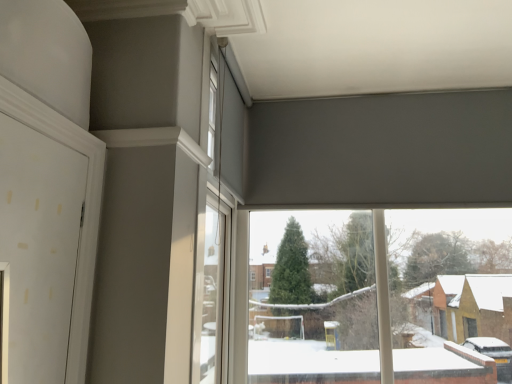
Question: From a real-world perspective, relative to white matte window at upper center, which ranks as the first window in left-to-right order, is transparent glass window at center, the 1th window when ordered from bottom to top, vertically above or below?

Choices:
 (A) above
 (B) below

Answer: (B)

Question: From the image's perspective, is transparent glass window at center, the 1th window when ordered from bottom to top, above or below white matte window at upper center, the 2th window from the bottom?

Choices:
 (A) above
 (B) below

Answer: (B)

Question: Considering their positions, is transparent glass window at center, the 1th window when ordered from bottom to top, located in front of or behind white matte window at upper center, which ranks as the first window in left-to-right order?

Choices:
 (A) behind
 (B) front

Answer: (A)

Question: Which is correct: white matte window at upper center, which ranks as the first window in left-to-right order, is inside transparent glass window at center, the 1th window when ordered from bottom to top, or outside of it?

Choices:
 (A) inside
 (B) outside

Answer: (B)

Question: Looking at their shapes, would you say white matte window at upper center, the 2th window from the bottom, is wider or thinner than transparent glass window at center, the 1th window when ordered from bottom to top?

Choices:
 (A) thin
 (B) wide

Answer: (A)

Question: Considering the positions of white matte window at upper center, the first window positioned from the top, and transparent glass window at center, the 1th window when ordered from bottom to top, in the image, is white matte window at upper center, the first window positioned from the top, taller or shorter than transparent glass window at center, the 1th window when ordered from bottom to top,?

Choices:
 (A) tall
 (B) short

Answer: (B)

Question: In the image, is white matte window at upper center, the 2th window from the bottom, positioned in front of or behind transparent glass window at center, which is counted as the second window, starting from the left?

Choices:
 (A) behind
 (B) front

Answer: (B)